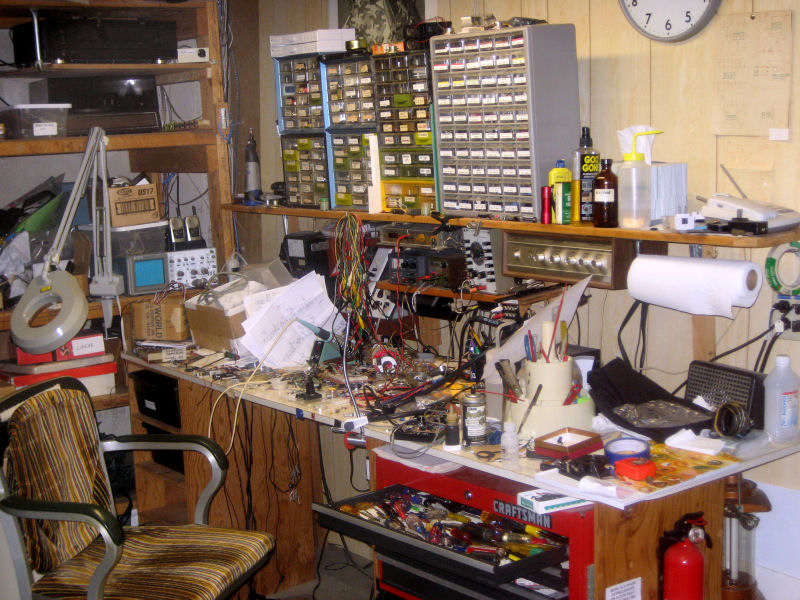
Image resolution: width=800 pixels, height=600 pixels. I want to click on lamp, so click(42, 280).